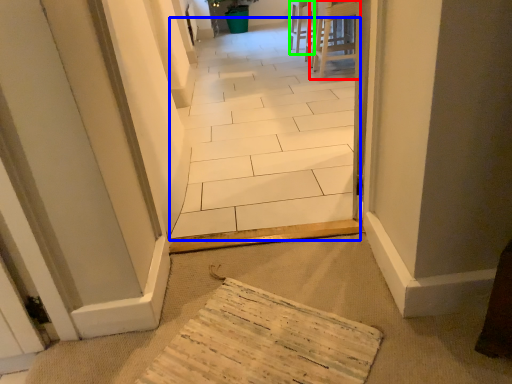
Question: Estimate the real-world distances between objects in this image. Which object is closer to furniture (highlighted by a red box), path (highlighted by a blue box) or chair (highlighted by a green box)?

Choices:
 (A) path
 (B) chair

Answer: (B)